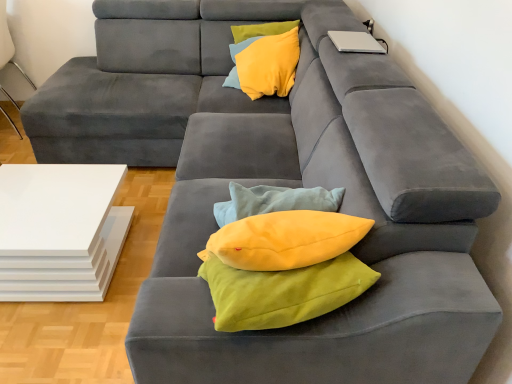
Question: Does white glossy table at lower left have a greater width compared to silver metallic laptop at upper right?

Choices:
 (A) no
 (B) yes

Answer: (B)

Question: Considering the relative positions of white glossy table at lower left and silver metallic laptop at upper right in the image provided, is white glossy table at lower left behind silver metallic laptop at upper right?

Choices:
 (A) yes
 (B) no

Answer: (B)

Question: From the image's perspective, is white glossy table at lower left over silver metallic laptop at upper right?

Choices:
 (A) no
 (B) yes

Answer: (A)

Question: From the image's perspective, does white glossy table at lower left appear lower than silver metallic laptop at upper right?

Choices:
 (A) no
 (B) yes

Answer: (B)

Question: Considering the relative sizes of white glossy table at lower left and silver metallic laptop at upper right in the image provided, is white glossy table at lower left thinner than silver metallic laptop at upper right?

Choices:
 (A) no
 (B) yes

Answer: (A)

Question: From a real-world perspective, is yellow soft cushion at upper center above or below silver metallic laptop at upper right?

Choices:
 (A) above
 (B) below

Answer: (B)

Question: Is point (286, 51) closer or farther from the camera than point (342, 34)?

Choices:
 (A) closer
 (B) farther

Answer: (B)

Question: Is yellow soft cushion at upper center wider or thinner than silver metallic laptop at upper right?

Choices:
 (A) thin
 (B) wide

Answer: (B)

Question: Considering their positions, is yellow soft cushion at upper center located in front of or behind silver metallic laptop at upper right?

Choices:
 (A) front
 (B) behind

Answer: (B)

Question: Does point (369, 51) appear closer or farther from the camera than point (52, 274)?

Choices:
 (A) closer
 (B) farther

Answer: (B)

Question: Considering the positions of silver metallic laptop at upper right and white glossy table at lower left in the image, is silver metallic laptop at upper right wider or thinner than white glossy table at lower left?

Choices:
 (A) thin
 (B) wide

Answer: (A)

Question: Considering the positions of silver metallic laptop at upper right and white glossy table at lower left in the image, is silver metallic laptop at upper right taller or shorter than white glossy table at lower left?

Choices:
 (A) short
 (B) tall

Answer: (A)

Question: Choose the correct answer: Is silver metallic laptop at upper right inside white glossy table at lower left or outside it?

Choices:
 (A) inside
 (B) outside

Answer: (B)

Question: From a real-world perspective, is silver metallic laptop at upper right above or below white glossy side table at left?

Choices:
 (A) below
 (B) above

Answer: (B)

Question: Relative to white glossy side table at left, is silver metallic laptop at upper right in front or behind?

Choices:
 (A) front
 (B) behind

Answer: (A)